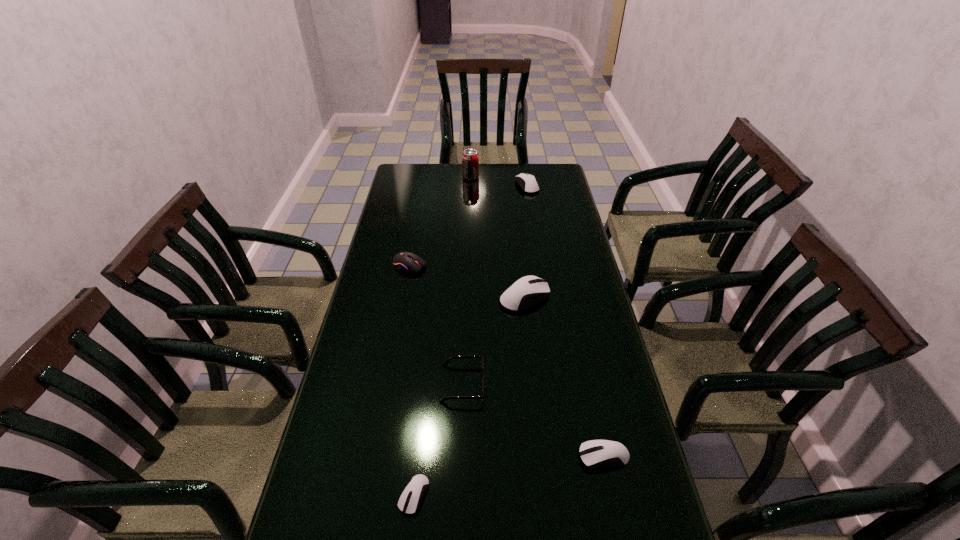
Identify the location of soda can. The image size is (960, 540). (470, 159).

The height and width of the screenshot is (540, 960). I want to click on the fourth farthest object, so click(528, 290).

Where is `the third nearest white mouse`? This screenshot has height=540, width=960. the third nearest white mouse is located at coordinates (528, 290).

This screenshot has width=960, height=540. I want to click on the farthest mouse, so click(x=529, y=185).

Image resolution: width=960 pixels, height=540 pixels. Find the location of `the farthest white mouse`. the farthest white mouse is located at coordinates (529, 185).

You are a GUI agent. You are given a task and a screenshot of the screen. Output one action in this format:
    pyautogui.click(x=<x>, y=<y>)
    Task: Click on the second farthest mouse
    
    Given the screenshot: What is the action you would take?
    pyautogui.click(x=404, y=261)

At what (x,y) coordinates should I click in order to perform the action: click on the leftmost object. Please return your answer as a coordinate pair (x, y). This screenshot has height=540, width=960. Looking at the image, I should click on (404, 261).

You are a GUI agent. You are given a task and a screenshot of the screen. Output one action in this format:
    pyautogui.click(x=<x>, y=<y>)
    Task: Click on the sunglasses
    
    Given the screenshot: What is the action you would take?
    pyautogui.click(x=447, y=361)

The height and width of the screenshot is (540, 960). In order to click on the second smallest white mouse in this screenshot , I will do `click(596, 453)`.

In order to click on the fourth tallest mouse in this screenshot , I will do `click(596, 453)`.